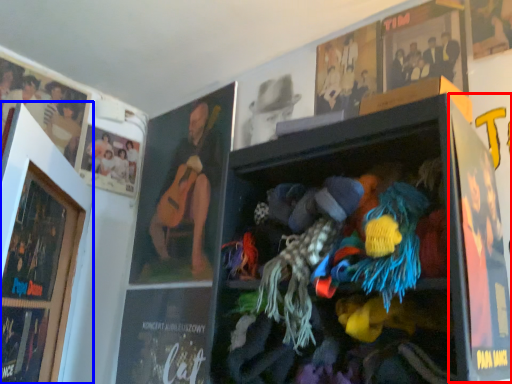
Question: Among these objects, which one is farthest to the camera, poster page (highlighted by a red box) or picture frame (highlighted by a blue box)?

Choices:
 (A) poster page
 (B) picture frame

Answer: (B)